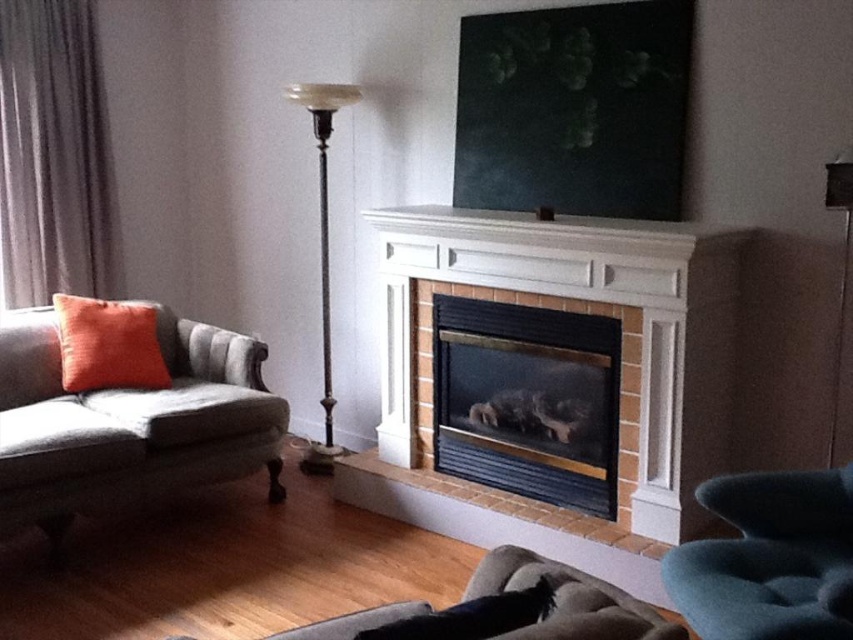
You are designing a layout for a living room and want to place a new sofa between the black glass fireplace at center and the metallic pole at center. Given that the sofa requires 1.2 meters of space, can you determine if there is enough space between them?

The black glass fireplace at center is smaller than the metallic pole at center, but the spatial relationship between their positions isn t specified in the Objects Description. Therefore, it s impossible to determine if there s enough space for the sofa based on the provided information.

You are arranging a party in the living room and want to place a large decorative item between the dark gray fabric curtain at left and the black fuzzy pillow at lower center. Which object can accommodate the item better based on their sizes?

The dark gray fabric curtain at left has a larger size compared to the black fuzzy pillow at lower center, so it can accommodate the large decorative item better.